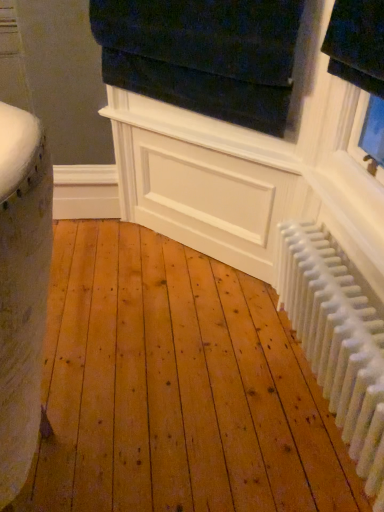
Describe the element at coordinates (337, 342) in the screenshot. The image size is (384, 512). I see `white plastic radiator at lower right` at that location.

At what (x,y) coordinates should I click in order to perform the action: click on white plastic radiator at lower right. Please return your answer as a coordinate pair (x, y). Image resolution: width=384 pixels, height=512 pixels. Looking at the image, I should click on (337, 342).

Locate an element on the screen. The width and height of the screenshot is (384, 512). white plastic radiator at lower right is located at coordinates (337, 342).